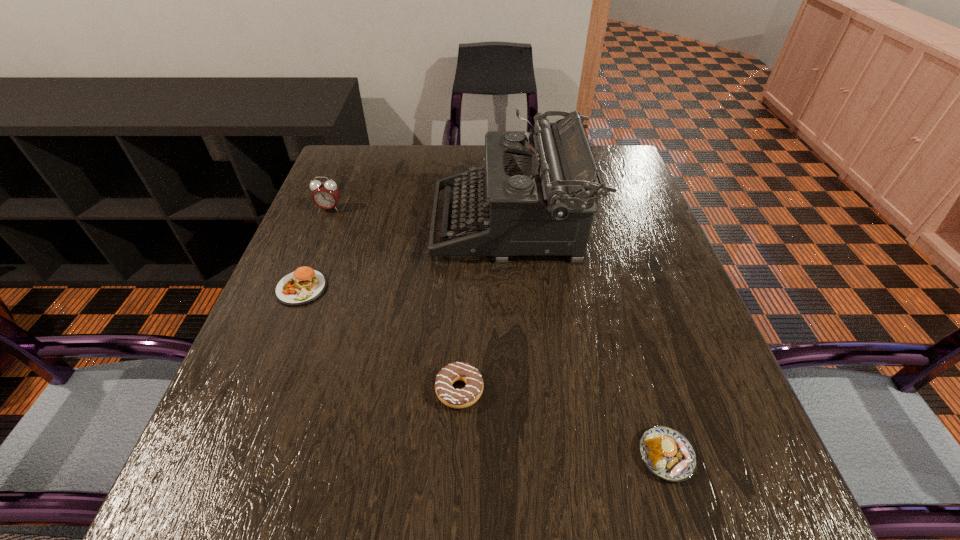
You are a GUI agent. You are given a task and a screenshot of the screen. Output one action in this format:
    pyautogui.click(x=<x>, y=<y>)
    Task: Click on the free space that satisfies the following two spatial constraints: 1. on the typing side of the typewriter; 2. on the back side of the pastry
    This screenshot has height=540, width=960.
    Given the screenshot: What is the action you would take?
    pyautogui.click(x=527, y=455)

I want to click on vacant space that satisfies the following two spatial constraints: 1. on the typing side of the typewriter; 2. on the front side of the fourth farthest object, so click(x=522, y=390).